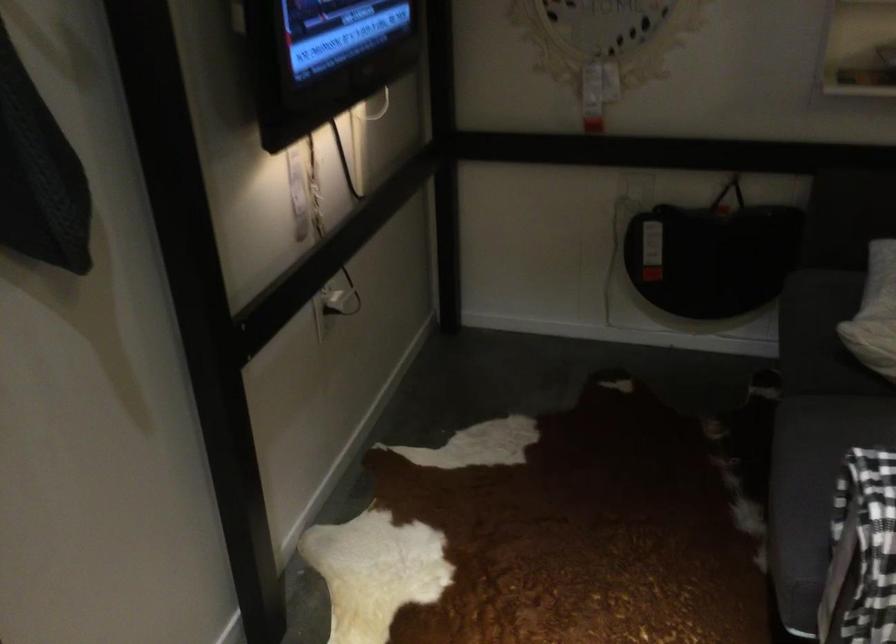
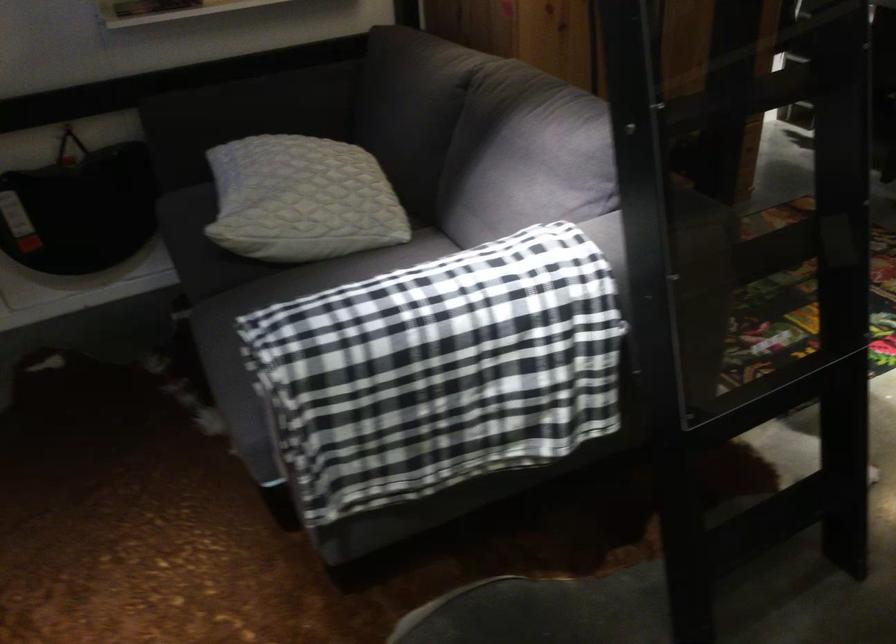
Question: The camera is either moving clockwise (left) or counter-clockwise (right) around the object. The first image is from the beginning of the video and the second image is from the end. Is the camera moving left or right when shooting the video?

Choices:
 (A) Left
 (B) Right

Answer: (A)